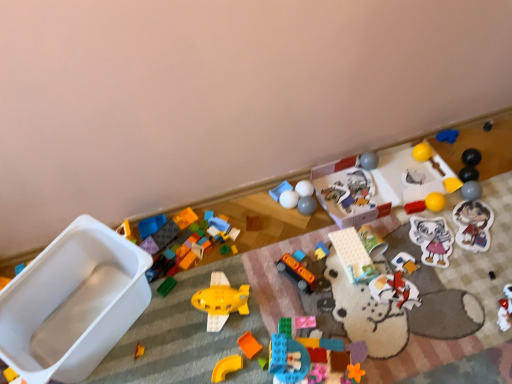
Locate an element on the screen. The height and width of the screenshot is (384, 512). vacant area that lies between matte plastic stickers at lower right, which is counted as the third toy, starting from the right, and rubber duck at center, positioned as the 15th toy in left-to-right order is located at coordinates (416, 239).